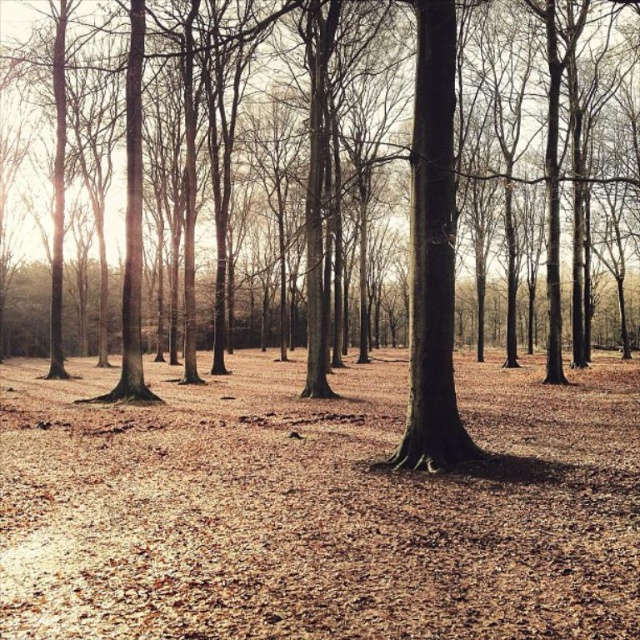
Question: Which point is closer to the camera taking this photo?

Choices:
 (A) (275, 611)
 (B) (419, 17)

Answer: (A)

Question: Is brown leafy ground at center below brown matte tree trunk at center?

Choices:
 (A) yes
 (B) no

Answer: (A)

Question: Among these objects, which one is nearest to the camera?

Choices:
 (A) brown leafy ground at center
 (B) brown matte tree trunk at center

Answer: (A)

Question: From the image, what is the correct spatial relationship of brown leafy ground at center in relation to brown matte tree trunk at center?

Choices:
 (A) above
 (B) below

Answer: (B)

Question: From the image, what is the correct spatial relationship of brown leafy ground at center in relation to brown matte tree trunk at center?

Choices:
 (A) right
 (B) left

Answer: (A)